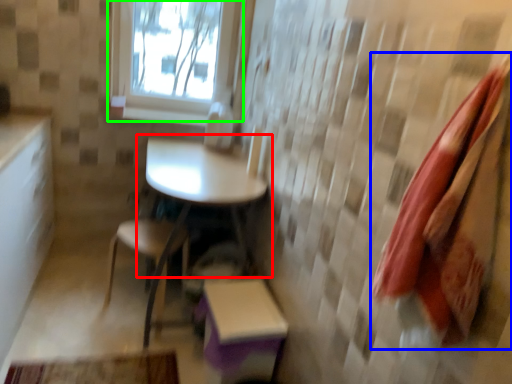
Question: Considering the real-world distances, which object is farthest from table (highlighted by a red box)? beach towel (highlighted by a blue box) or window (highlighted by a green box)?

Choices:
 (A) beach towel
 (B) window

Answer: (A)